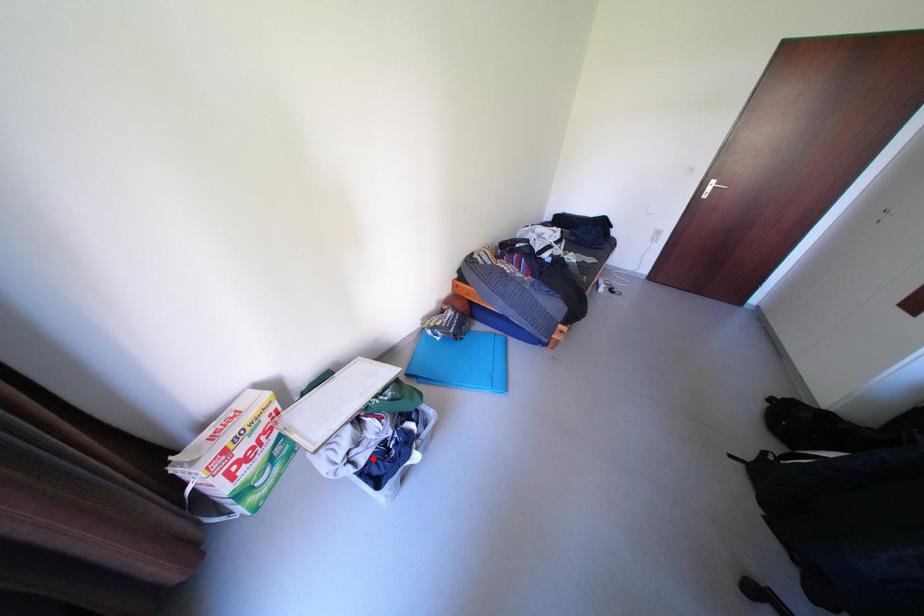
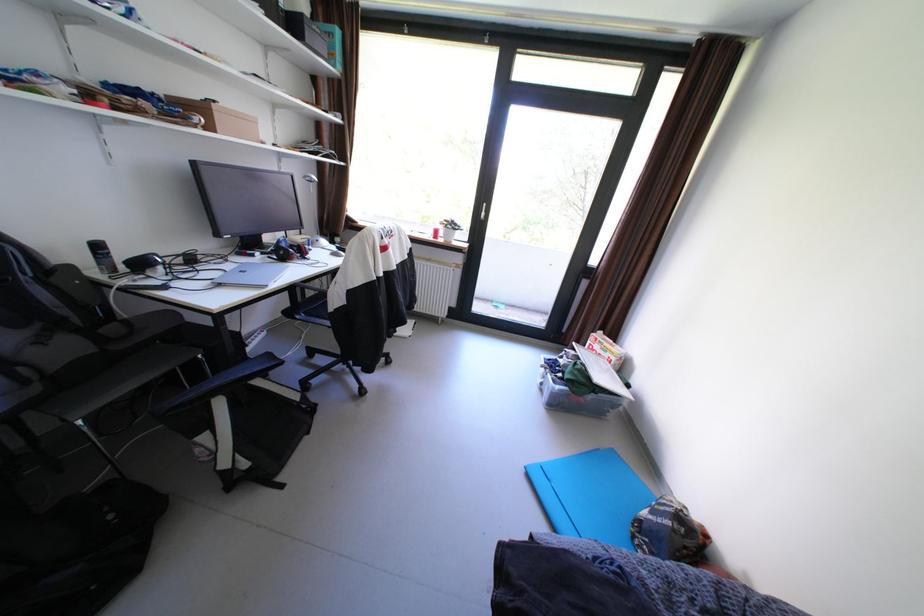
Question: I am providing you with two images of the same scene from different viewpoints. Given a red point in image1, look at the same physical point in image2. Is it:

Choices:
 (A) Closer to the viewpoint
 (B) Farther from the viewpoint

Answer: (A)